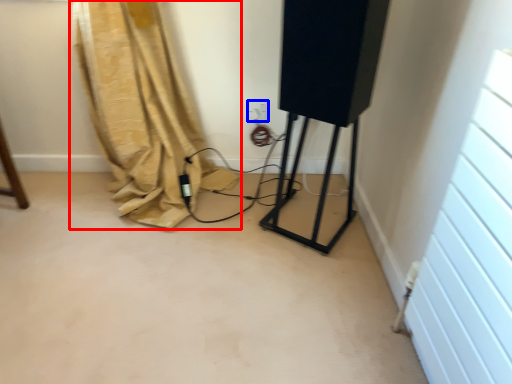
Question: Which of the following is the farthest to the observer, curtain (highlighted by a red box) or electric outlet (highlighted by a blue box)?

Choices:
 (A) curtain
 (B) electric outlet

Answer: (B)